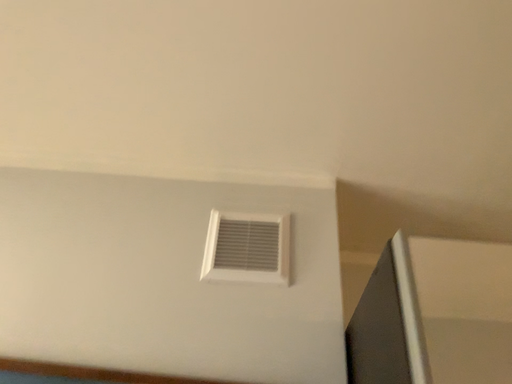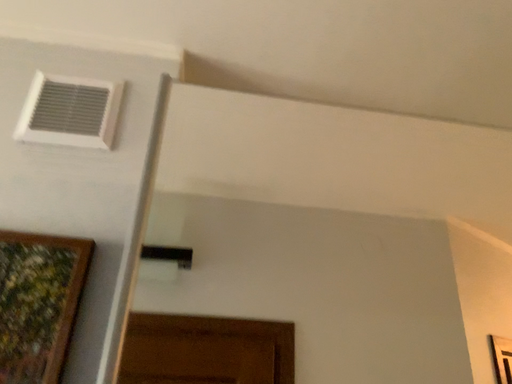
Question: How did the camera likely rotate when shooting the video?

Choices:
 (A) rotated downward
 (B) rotated upward

Answer: (A)